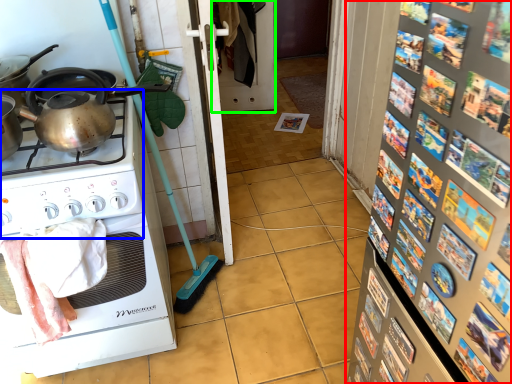
Question: Which object is positioned farthest from bulletin board (highlighted by a red box)? Select from gas stove (highlighted by a blue box) and screen door (highlighted by a green box).

Choices:
 (A) gas stove
 (B) screen door

Answer: (B)